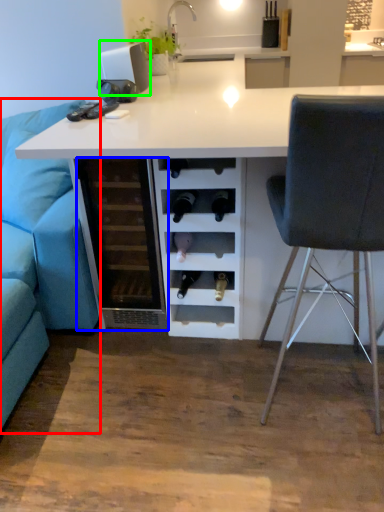
Question: Which object is the farthest from studio couch (highlighted by a red box)? Choose among these: file cabinet (highlighted by a blue box) or appliance (highlighted by a green box).

Choices:
 (A) file cabinet
 (B) appliance

Answer: (B)